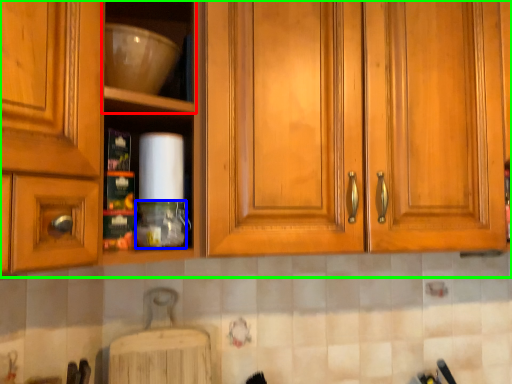
Question: Which object is the farthest from shelf (highlighted by a red box)? Choose among these: bottle (highlighted by a blue box) or cabinetry (highlighted by a green box).

Choices:
 (A) bottle
 (B) cabinetry

Answer: (A)